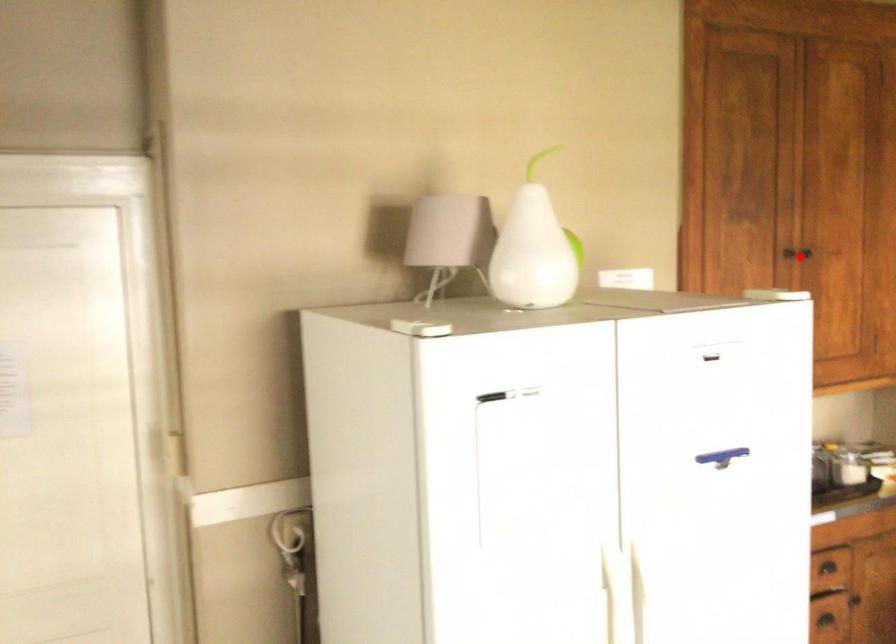
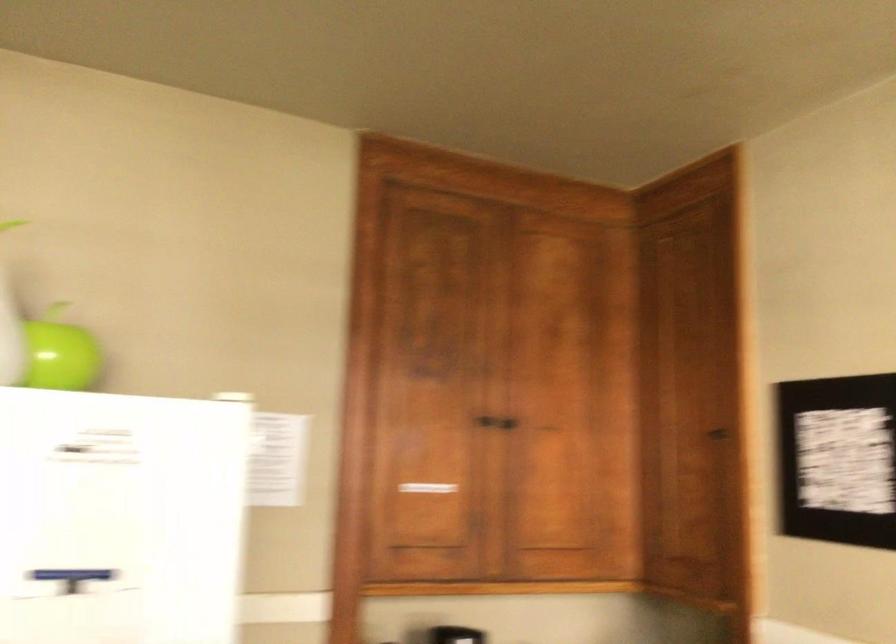
The point at the highlighted location is marked in the first image. Where is the corresponding point in the second image?

(485, 420)